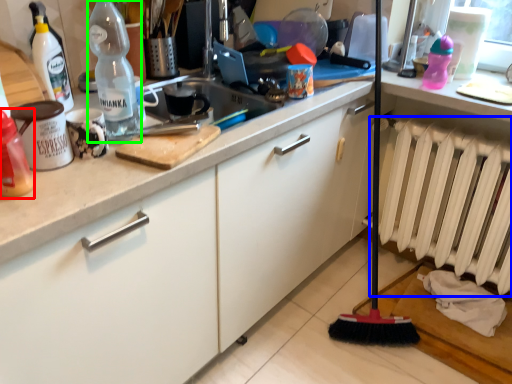
Question: Considering the real-world distances, which object is farthest from bottle (highlighted by a red box)? radiator (highlighted by a blue box) or bottle (highlighted by a green box)?

Choices:
 (A) radiator
 (B) bottle

Answer: (A)